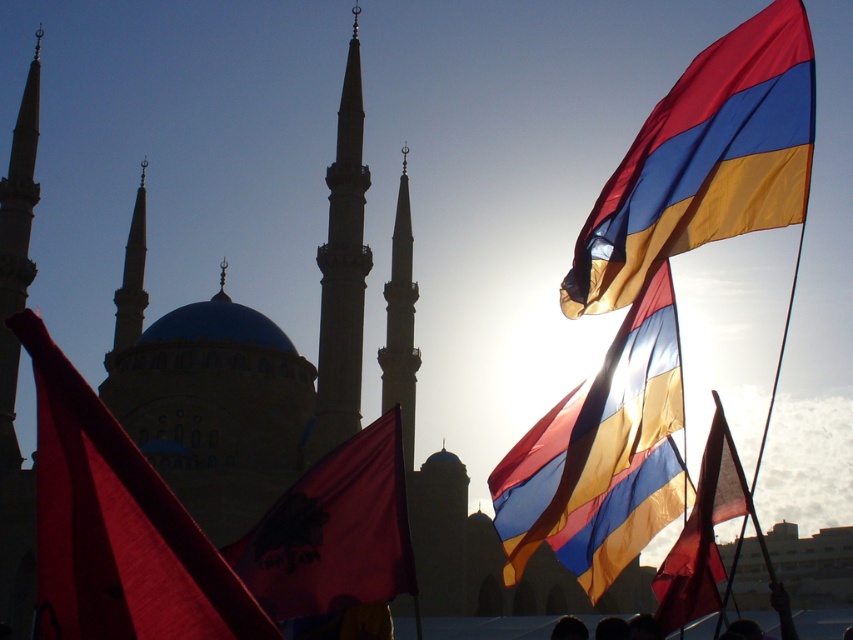
You are standing in front of the mosque and want to take a photo of both the point at coordinates [321,600] and the point at coordinates [712,472]. Which point should you focus on first to ensure both are in clear view?

You should focus on point [321,600] first because it is closer to you than point [712,472], ensuring both points are in clear view.

You are a photographer standing in front of the mosque and want to capture both the silky blue and yellow flag at upper right and the matte red flag at center in your shot. Which flag should you focus on first to ensure both are in clear view?

You should focus on the silky blue and yellow flag at upper right first because it is closer to you than the matte red flag at center, ensuring both will be in focus when properly adjusted.

You are a photographer trying to capture the mosque and its flags. You want to ensure that the matte red flag at left and the silky blue and yellow flag at upper right are both visible in your photo. Which flag should you focus on to make sure both are in the frame?

To ensure both the matte red flag at left and the silky blue and yellow flag at upper right are visible, focus on the silky blue and yellow flag at upper right because the matte red flag at left is in front of it, so it will naturally be included in the frame when the background flag is in view.